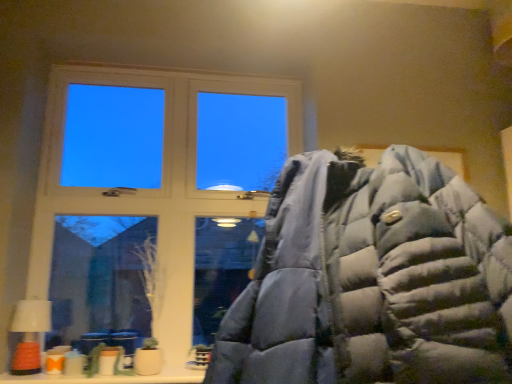
This screenshot has width=512, height=384. Describe the element at coordinates (372, 280) in the screenshot. I see `matte blue puffer jacket at center` at that location.

Identify the location of orange matte lampshade at lower left. This screenshot has width=512, height=384. (29, 334).

From the image's perspective, who appears lower, white wood window at upper left or matte blue puffer jacket at center?

matte blue puffer jacket at center, from the image's perspective.

Does white wood window at upper left have a smaller size compared to matte blue puffer jacket at center?

Yes.

Which object is closer to the camera taking this photo, white wood window at upper left or matte blue puffer jacket at center?

Positioned in front is matte blue puffer jacket at center.

How many degrees apart are the facing directions of white wood window at upper left and matte blue puffer jacket at center?

There is a 1.67-degree angle between the facing directions of white wood window at upper left and matte blue puffer jacket at center.

Does matte blue puffer jacket at center have a larger size compared to orange matte lampshade at lower left?

Yes.

Between point (416, 208) and point (17, 351), which one is positioned behind?

The point (17, 351) is farther.

Do you think matte blue puffer jacket at center is within orange matte lampshade at lower left, or outside of it?

The correct answer is: outside.

Which of these two, matte blue puffer jacket at center or orange matte lampshade at lower left, is thinner?

With smaller width is orange matte lampshade at lower left.

In the scene shown: Could you tell me if matte blue puffer jacket at center is turned towards white wood window at upper left?

No.

Is matte blue puffer jacket at center bigger or smaller than white wood window at upper left?

In the image, matte blue puffer jacket at center appears to be larger than white wood window at upper left.

Would you say matte blue puffer jacket at center is inside or outside white wood window at upper left?

matte blue puffer jacket at center cannot be found inside white wood window at upper left.

From a real-world perspective, which object rests below the other?

matte blue puffer jacket at center.

Considering their positions, is orange matte lampshade at lower left located in front of or behind white wood window at upper left?

Visually, orange matte lampshade at lower left is located in front of white wood window at upper left.

Considering the sizes of objects orange matte lampshade at lower left and white wood window at upper left in the image provided, who is smaller, orange matte lampshade at lower left or white wood window at upper left?

orange matte lampshade at lower left is smaller.

In terms of width, does orange matte lampshade at lower left look wider or thinner when compared to white wood window at upper left?

orange matte lampshade at lower left is wider than white wood window at upper left.

Measure the distance from orange matte lampshade at lower left to matte blue puffer jacket at center.

They are 1.37 meters apart.

Is orange matte lampshade at lower left at the right side of matte blue puffer jacket at center?

In fact, orange matte lampshade at lower left is to the left of matte blue puffer jacket at center.

Is orange matte lampshade at lower left thinner than matte blue puffer jacket at center?

Yes, orange matte lampshade at lower left is thinner than matte blue puffer jacket at center.

Between orange matte lampshade at lower left and matte blue puffer jacket at center, which one is positioned behind?

orange matte lampshade at lower left is behind.

Could orange matte lampshade at lower left be considered to be inside white wood window at upper left?

No, orange matte lampshade at lower left is not inside white wood window at upper left.

At what (x,y) coordinates should I click in order to perform the action: click on table lamp below the white wood window at upper left (from the image's perspective). Please return your answer as a coordinate pair (x, y). Looking at the image, I should click on (29, 334).

Are white wood window at upper left and orange matte lampshade at lower left making contact?

No, white wood window at upper left is not beside orange matte lampshade at lower left.

Locate an element on the screen. jacket in front of the white wood window at upper left is located at coordinates tap(372, 280).

Locate an element on the screen. table lamp behind the matte blue puffer jacket at center is located at coordinates (29, 334).

From the picture: When comparing their distances from white wood window at upper left, does orange matte lampshade at lower left or matte blue puffer jacket at center seem further?

matte blue puffer jacket at center is further to white wood window at upper left.

When comparing their distances from matte blue puffer jacket at center, does orange matte lampshade at lower left or white wood window at upper left seem further?

The object further to matte blue puffer jacket at center is orange matte lampshade at lower left.

Consider the image. From the image, which object appears to be farther from orange matte lampshade at lower left, matte blue puffer jacket at center or white wood window at upper left?

The object further to orange matte lampshade at lower left is matte blue puffer jacket at center.

Considering their positions, is white wood window at upper left positioned further to matte blue puffer jacket at center than orange matte lampshade at lower left?

The object further to matte blue puffer jacket at center is orange matte lampshade at lower left.

From the image, which object appears to be farther from orange matte lampshade at lower left, white wood window at upper left or matte blue puffer jacket at center?

matte blue puffer jacket at center is further to orange matte lampshade at lower left.

Based on their spatial positions, is matte blue puffer jacket at center or orange matte lampshade at lower left closer to white wood window at upper left?

orange matte lampshade at lower left lies closer to white wood window at upper left than the other object.

The image size is (512, 384). In order to click on table lamp located between matte blue puffer jacket at center and white wood window at upper left in the depth direction in this screenshot , I will do pyautogui.click(x=29, y=334).